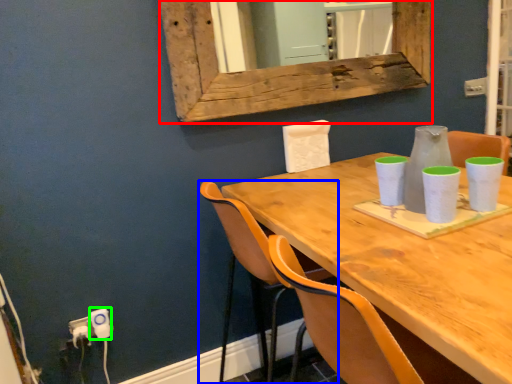
Question: Considering the real-world distances, which object is farthest from window frame (highlighted by a red box)? chair (highlighted by a blue box) or electric outlet (highlighted by a green box)?

Choices:
 (A) chair
 (B) electric outlet

Answer: (B)